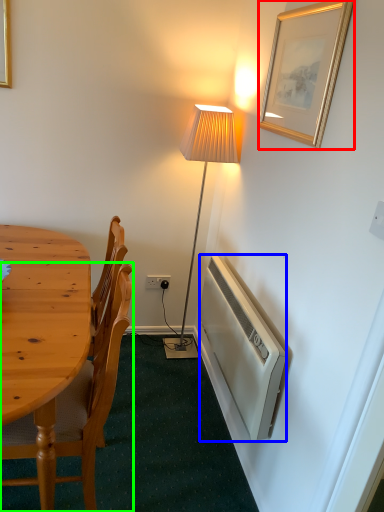
Question: Which object is the farthest from picture frame (highlighted by a red box)? Choose among these: radiator (highlighted by a blue box) or chair (highlighted by a green box).

Choices:
 (A) radiator
 (B) chair

Answer: (B)